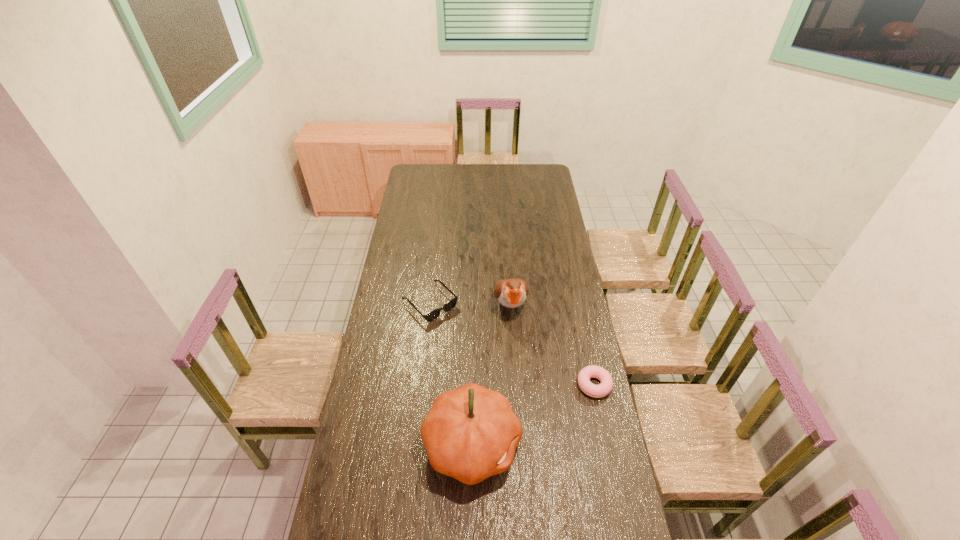
Find the location of a particular element. This screenshot has height=540, width=960. free space on the desktop that is between the pumpkin and the second nearest object and is positioned at the face of the bird is located at coordinates (530, 416).

Locate an element on the screen. Image resolution: width=960 pixels, height=540 pixels. free space on the desktop that is between the pumpkin and the shortest object and is positioned at the front lenses of the second shortest object is located at coordinates (539, 412).